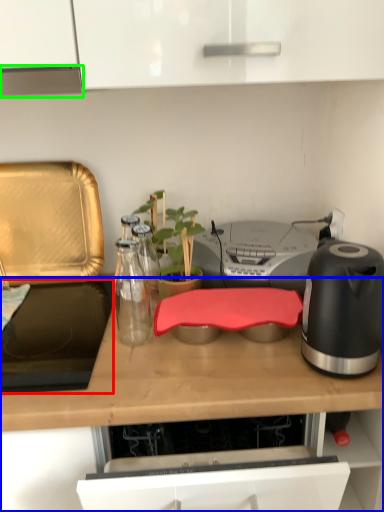
Question: Based on their relative distances, which object is farther from gas stove (highlighted by a red box)? Choose from countertop (highlighted by a blue box) and exhaust hood (highlighted by a green box).

Choices:
 (A) countertop
 (B) exhaust hood

Answer: (B)